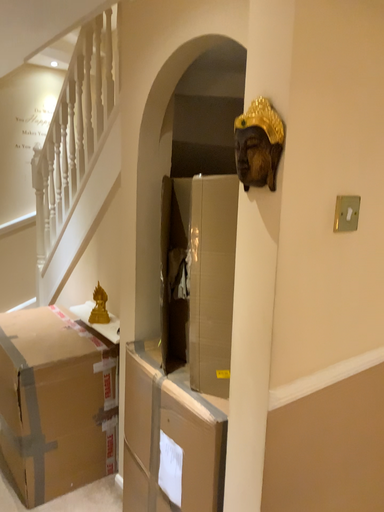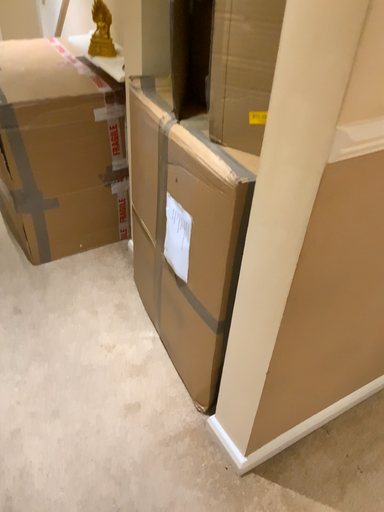
Question: How did the camera likely rotate when shooting the video?

Choices:
 (A) rotated left
 (B) rotated right

Answer: (A)